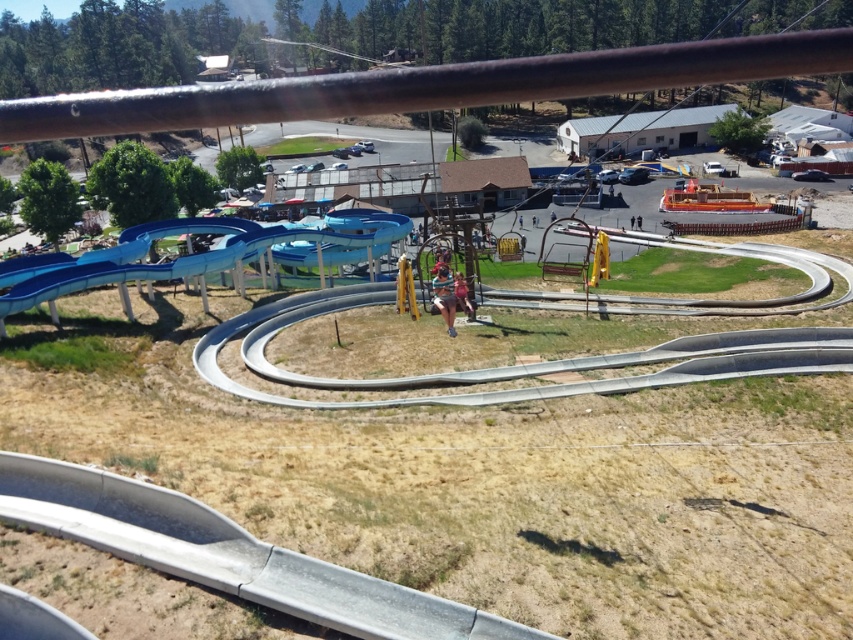
Question: Is rusty metal rail at upper center above blue smooth water slide at left?

Choices:
 (A) yes
 (B) no

Answer: (A)

Question: Is rusty metal rail at upper center smaller than blue smooth water slide at left?

Choices:
 (A) yes
 (B) no

Answer: (B)

Question: Is rusty metal rail at upper center bigger than blue smooth water slide at left?

Choices:
 (A) yes
 (B) no

Answer: (A)